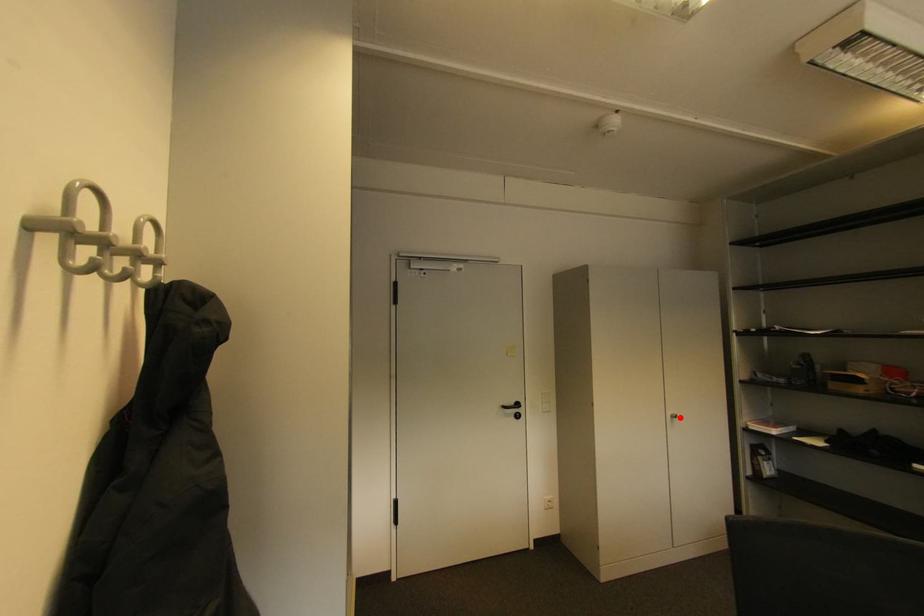
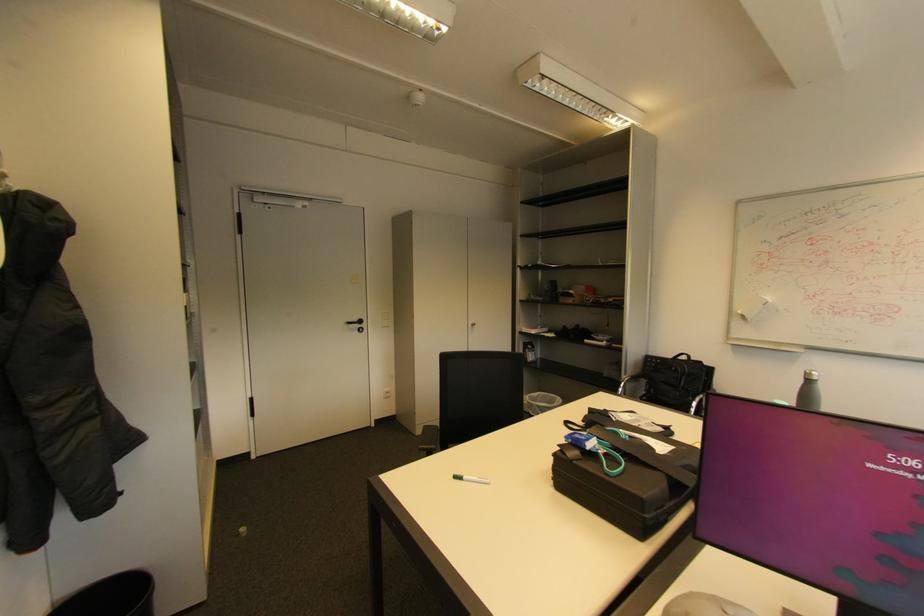
Find the pixel in the second image that matches the highlighted location in the first image.

(479, 326)